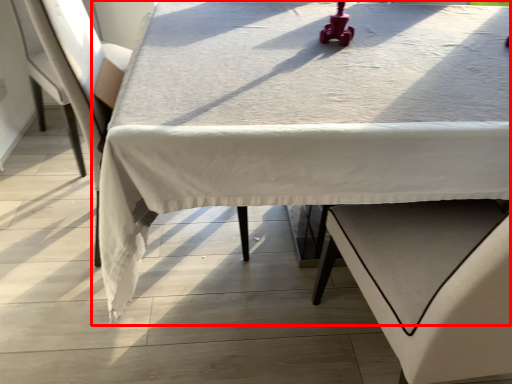
Question: Where is table (annotated by the red box) located in relation to armchair in the image?

Choices:
 (A) right
 (B) left

Answer: (A)